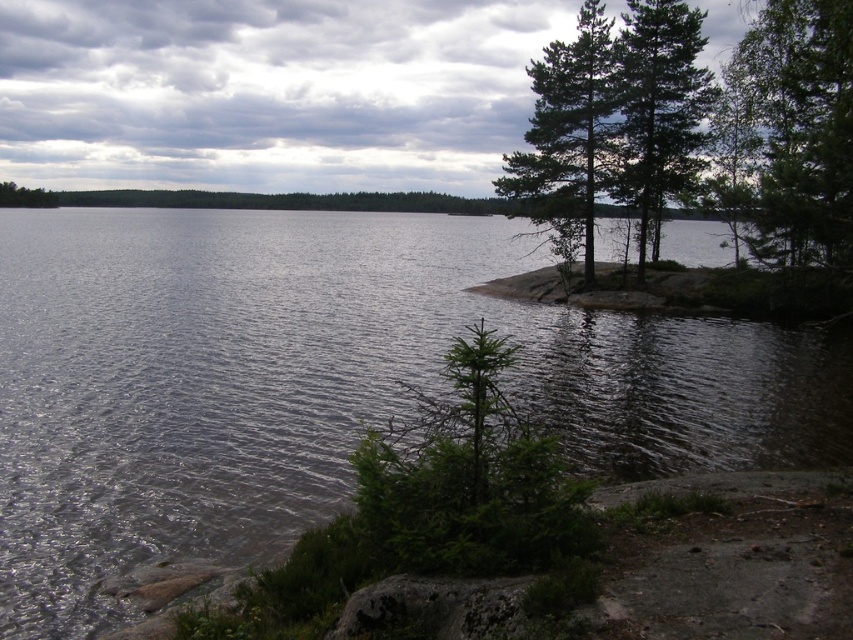
Consider the image. You are standing at the center of the lakeside scene. Looking towards the upper right corner of the image, can you see the green matte tree at upper right? Please explain its position relative to the center of the scene.

Yes, the green matte tree at upper right is located at 20.6 percent from the left edge and 93.6 percent from the bottom edge of the image. Since you are at the center, it is positioned to the upper right direction, approximately 20.6 cm to the right and 93.6 cm above your current position if the image were 100 cm in width and height.

You are standing at the lakeside and want to walk towards the green textured pine trees at upper right and the green matte tree at right. Which tree will you reach first?

The green textured pine trees at upper right will be reached first because it is closer to you than the green matte tree at right.